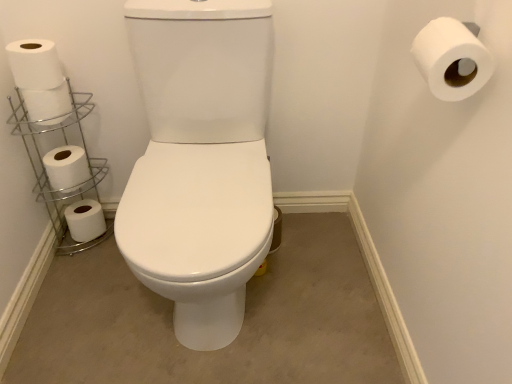
Question: Is white matte toilet paper at upper right, positioned as the 5th toilet paper in back-to-front order, bigger than silver/metallic toilet paper holder at left?

Choices:
 (A) yes
 (B) no

Answer: (B)

Question: Is white matte toilet paper at upper right, positioned as the 5th toilet paper in back-to-front order, at the left side of silver/metallic toilet paper holder at left?

Choices:
 (A) yes
 (B) no

Answer: (B)

Question: Is white matte toilet paper at upper right, positioned as the 5th toilet paper in back-to-front order, not within silver/metallic toilet paper holder at left?

Choices:
 (A) yes
 (B) no

Answer: (A)

Question: Considering the relative sizes of white matte toilet paper at upper right, positioned as the 5th toilet paper in back-to-front order, and silver/metallic toilet paper holder at left in the image provided, is white matte toilet paper at upper right, positioned as the 5th toilet paper in back-to-front order, smaller than silver/metallic toilet paper holder at left?

Choices:
 (A) no
 (B) yes

Answer: (B)

Question: From a real-world perspective, is white matte toilet paper at upper right, the fifth toilet paper viewed from the left, on silver/metallic toilet paper holder at left?

Choices:
 (A) no
 (B) yes

Answer: (B)

Question: Does white matte toilet paper at upper right, the first toilet paper viewed from the front, lie in front of silver/metallic toilet paper holder at left?

Choices:
 (A) yes
 (B) no

Answer: (A)

Question: Considering the relative sizes of white matte toilet paper at lower left, the 5th toilet paper when ordered from front to back, and white matte toilet paper at left, which is the second toilet paper from right to left, in the image provided, is white matte toilet paper at lower left, the 5th toilet paper when ordered from front to back, wider than white matte toilet paper at left, which is the second toilet paper from right to left,?

Choices:
 (A) no
 (B) yes

Answer: (B)

Question: Is white matte toilet paper at lower left, marked as the fifth toilet paper in a right-to-left arrangement, surrounding white matte toilet paper at left, placed as the 2th toilet paper when sorted from front to back?

Choices:
 (A) no
 (B) yes

Answer: (A)

Question: Can you confirm if white matte toilet paper at lower left, marked as the fifth toilet paper in a right-to-left arrangement, is shorter than white matte toilet paper at left, which is the second toilet paper from right to left?

Choices:
 (A) yes
 (B) no

Answer: (B)

Question: Can you confirm if white matte toilet paper at lower left, marked as the fifth toilet paper in a right-to-left arrangement, is smaller than white matte toilet paper at left, which appears as the fourth toilet paper when viewed from the left?

Choices:
 (A) yes
 (B) no

Answer: (A)

Question: Can you confirm if white matte toilet paper at lower left, the 5th toilet paper when ordered from front to back, is positioned to the left of white matte toilet paper at left, which appears as the fourth toilet paper when viewed from the left?

Choices:
 (A) no
 (B) yes

Answer: (B)

Question: From a real-world perspective, is white matte toilet paper at lower left, the 1th toilet paper viewed from the back, beneath white matte toilet paper at left, which is the second toilet paper from right to left?

Choices:
 (A) yes
 (B) no

Answer: (A)

Question: From a real-world perspective, is white matte toilet paper at left, which appears as the 4th toilet paper when viewed from the back, located beneath white matte toilet paper at upper right, the first toilet paper viewed from the front?

Choices:
 (A) no
 (B) yes

Answer: (B)